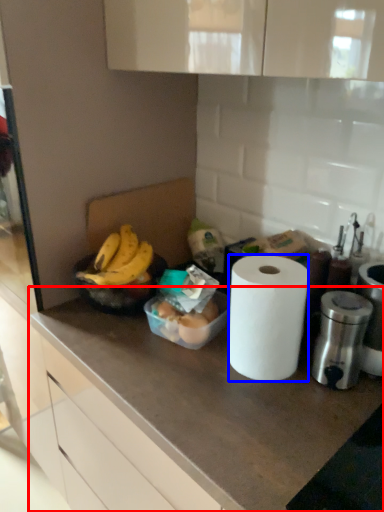
Question: Which point is further to the camera, countertop (highlighted by a red box) or paper towel (highlighted by a blue box)?

Choices:
 (A) countertop
 (B) paper towel

Answer: (B)